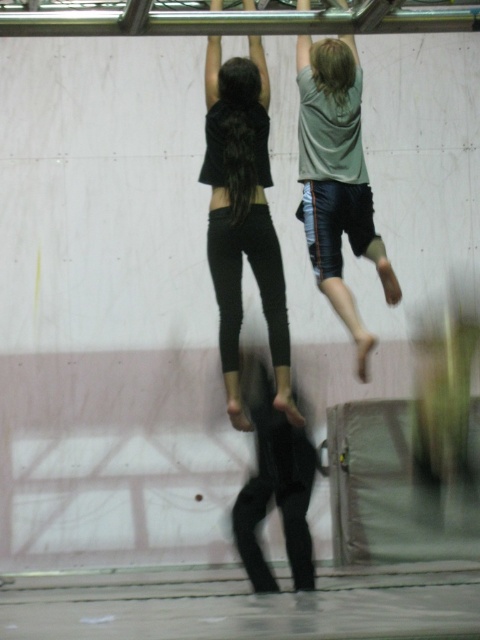
Question: Does black matte leggings at center appear on the right side of light gray cotton shirt at upper right?

Choices:
 (A) yes
 (B) no

Answer: (B)

Question: Which point is closer to the camera?

Choices:
 (A) coord(271,317)
 (B) coord(266,483)
 (C) coord(355,168)

Answer: (B)

Question: Does black matte leggings at center come behind black matte pants at center?

Choices:
 (A) yes
 (B) no

Answer: (A)

Question: Among these objects, which one is farthest from the camera?

Choices:
 (A) light gray cotton shirt at upper right
 (B) black matte leggings at center

Answer: (A)

Question: Can you confirm if black matte leggings at center is positioned below light gray cotton shirt at upper right?

Choices:
 (A) yes
 (B) no

Answer: (A)

Question: Which point is farther from the camera taking this photo?

Choices:
 (A) (x=299, y=45)
 (B) (x=241, y=228)
 (C) (x=257, y=499)

Answer: (A)